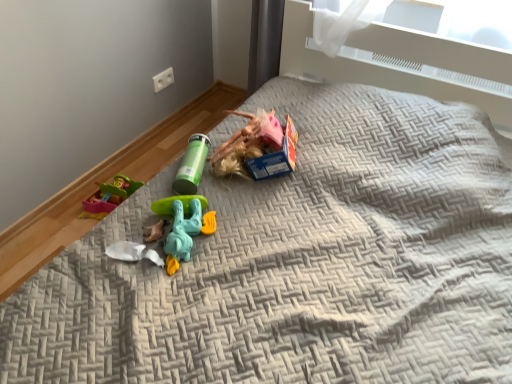
Question: From a real-world perspective, is teal plastic toy at center, positioned as the 1th toy in front-to-back order, positioned over green plastic tube at center, which is the third toy in bottom-to-top order, based on gravity?

Choices:
 (A) no
 (B) yes

Answer: (A)

Question: From a real-world perspective, is teal plastic toy at center, which is the second toy from bottom to top, physically below green plastic tube at center, which is the third toy in bottom-to-top order?

Choices:
 (A) no
 (B) yes

Answer: (B)

Question: Can you confirm if teal plastic toy at center, positioned as the 1th toy in front-to-back order, is bigger than green plastic tube at center, which appears as the 1th toy when viewed from the top?

Choices:
 (A) no
 (B) yes

Answer: (B)

Question: Does teal plastic toy at center, which ranks as the third toy in back-to-front order, have a greater height compared to green plastic tube at center, marked as the first toy in a back-to-front arrangement?

Choices:
 (A) no
 (B) yes

Answer: (A)

Question: Considering the relative positions of teal plastic toy at center, positioned as the 2th toy in top-to-bottom order, and green plastic tube at center, which is the third toy in bottom-to-top order, in the image provided, is teal plastic toy at center, positioned as the 2th toy in top-to-bottom order, in front of green plastic tube at center, which is the third toy in bottom-to-top order,?

Choices:
 (A) no
 (B) yes

Answer: (B)

Question: Considering the relative positions of teal plastic toy at center, which ranks as the third toy in back-to-front order, and green plastic tube at center, which is the third toy in bottom-to-top order, in the image provided, is teal plastic toy at center, which ranks as the third toy in back-to-front order, behind green plastic tube at center, which is the third toy in bottom-to-top order,?

Choices:
 (A) no
 (B) yes

Answer: (A)

Question: Considering the relative positions of teal plastic toy at center, positioned as the 2th toy in top-to-bottom order, and white plastic toy at center, marked as the 3th toy in a top-to-bottom arrangement, in the image provided, is teal plastic toy at center, positioned as the 2th toy in top-to-bottom order, to the left of white plastic toy at center, marked as the 3th toy in a top-to-bottom arrangement, from the viewer's perspective?

Choices:
 (A) yes
 (B) no

Answer: (B)

Question: Does teal plastic toy at center, which ranks as the third toy in back-to-front order, come in front of white plastic toy at center, the second toy in the back-to-front sequence?

Choices:
 (A) yes
 (B) no

Answer: (A)

Question: Does teal plastic toy at center, which is the second toy from bottom to top, come behind white plastic toy at center, marked as the 3th toy in a top-to-bottom arrangement?

Choices:
 (A) yes
 (B) no

Answer: (B)

Question: Is teal plastic toy at center, which ranks as the third toy in back-to-front order, positioned with its back to white plastic toy at center, positioned as the 1th toy in bottom-to-top order?

Choices:
 (A) yes
 (B) no

Answer: (B)

Question: Are teal plastic toy at center, which is the second toy from bottom to top, and white plastic toy at center, positioned as the 1th toy in bottom-to-top order, far apart?

Choices:
 (A) yes
 (B) no

Answer: (B)

Question: Is teal plastic toy at center, positioned as the 2th toy in top-to-bottom order, taller than white plastic toy at center, acting as the second toy starting from the front?

Choices:
 (A) no
 (B) yes

Answer: (B)

Question: Considering the relative sizes of green plastic tube at center, marked as the first toy in a back-to-front arrangement, and white plastic toy at center, the second toy in the back-to-front sequence, in the image provided, is green plastic tube at center, marked as the first toy in a back-to-front arrangement, shorter than white plastic toy at center, the second toy in the back-to-front sequence,?

Choices:
 (A) no
 (B) yes

Answer: (A)